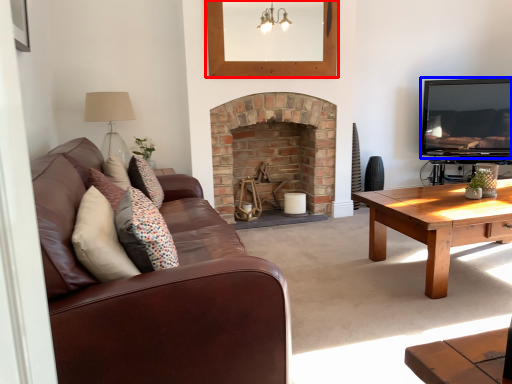
Question: Which object is further to the camera taking this photo, picture frame (highlighted by a red box) or television (highlighted by a blue box)?

Choices:
 (A) picture frame
 (B) television

Answer: (B)